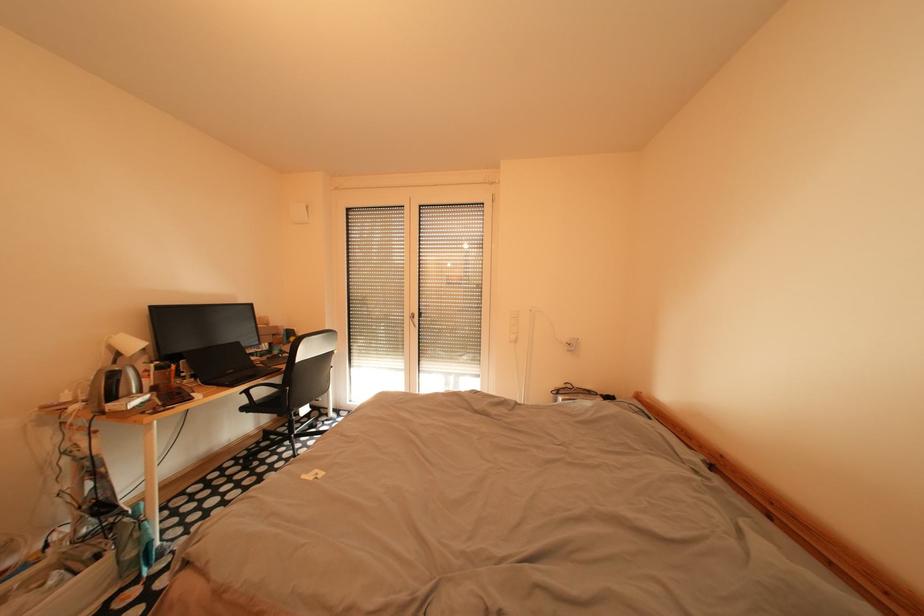
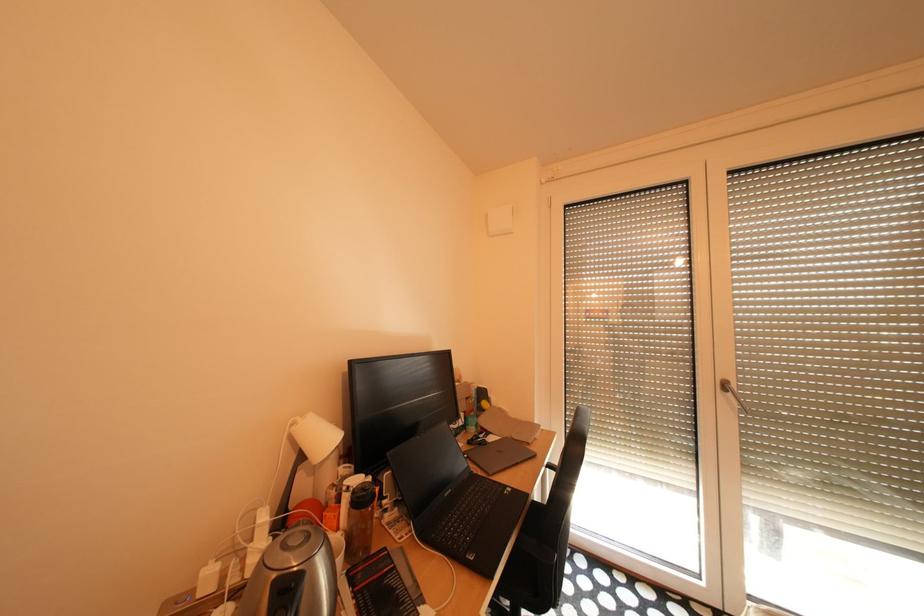
What movement of the cameraman would produce the second image?

The cameraman walked toward left, forward.